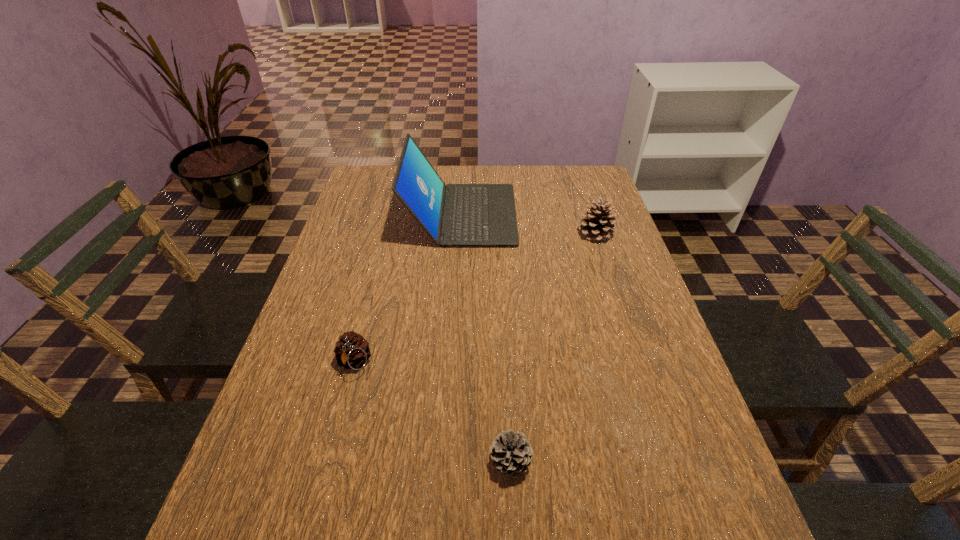
Locate an element on the screen. vacant space situated 0.210m on the right of the second pinecone from left to right is located at coordinates (643, 462).

Identify the location of object at the far edge. Image resolution: width=960 pixels, height=540 pixels. (454, 215).

The width and height of the screenshot is (960, 540). I want to click on object located in the left edge section of the desktop, so click(x=352, y=350).

Find the location of `object that is positioned at the right edge`. object that is positioned at the right edge is located at coordinates (597, 224).

Image resolution: width=960 pixels, height=540 pixels. I want to click on vacant space at the far edge of the desktop, so click(x=537, y=194).

Identify the location of free space at the left edge of the desktop. The height and width of the screenshot is (540, 960). (356, 262).

You are a GUI agent. You are given a task and a screenshot of the screen. Output one action in this format:
    pyautogui.click(x=<x>, y=<y>)
    Task: Click on the vacant region at the right edge
    
    Given the screenshot: What is the action you would take?
    pyautogui.click(x=670, y=526)

In the image, there is a desktop. At what (x,y) coordinates should I click in order to perform the action: click on vacant space at the far right corner. Please return your answer as a coordinate pair (x, y). The height and width of the screenshot is (540, 960). Looking at the image, I should click on (574, 168).

At what (x,y) coordinates should I click in order to perform the action: click on unoccupied area between the third farthest object and the nearest object. Please return your answer as a coordinate pair (x, y). This screenshot has height=540, width=960. Looking at the image, I should click on (432, 412).

I want to click on free space between the nearest object and the tallest object, so click(486, 338).